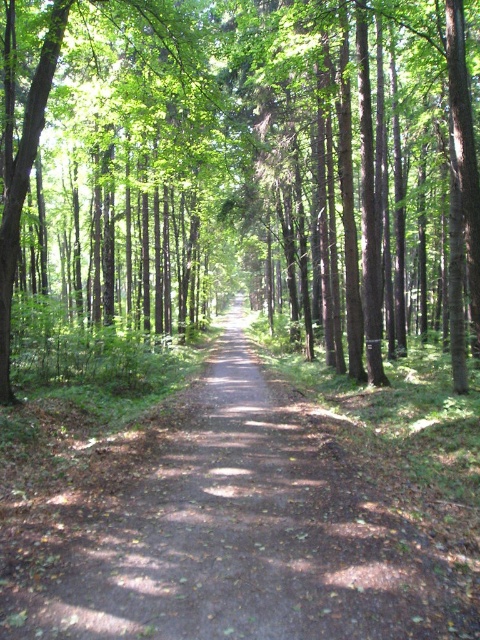
Question: Which object is farther from the camera taking this photo?

Choices:
 (A) green leafy tree at center
 (B) dirt path at center

Answer: (A)

Question: Does green leafy tree at center have a greater width compared to dirt path at center?

Choices:
 (A) no
 (B) yes

Answer: (B)

Question: Is green leafy tree at center to the right of dirt path at center from the viewer's perspective?

Choices:
 (A) yes
 (B) no

Answer: (A)

Question: Where is green leafy tree at center located in relation to dirt path at center in the image?

Choices:
 (A) left
 (B) right

Answer: (B)